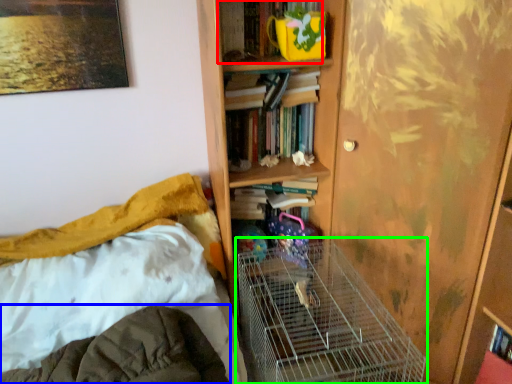
Question: Estimate the real-world distances between objects in this image. Which object is closer to book (highlighted by a red box), blanket (highlighted by a blue box) or bird cage (highlighted by a green box)?

Choices:
 (A) blanket
 (B) bird cage

Answer: (B)